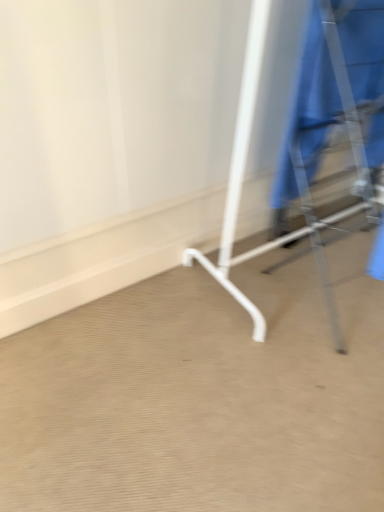
What is the approximate height of blue fabric robe at right?

blue fabric robe at right is 25.78 inches tall.

Describe the element at coordinates (309, 111) in the screenshot. I see `blue fabric robe at right` at that location.

Locate an element on the screen. Image resolution: width=384 pixels, height=512 pixels. blue fabric robe at right is located at coordinates (309, 111).

You are a GUI agent. You are given a task and a screenshot of the screen. Output one action in this format:
    pyautogui.click(x=<x>, y=<y>)
    Task: Click on the metallic silver coat rack at right
    This screenshot has height=512, width=384.
    Given the screenshot: What is the action you would take?
    click(x=312, y=130)

Describe the element at coordinates (312, 130) in the screenshot. The image size is (384, 512). I see `metallic silver coat rack at right` at that location.

Find the location of a particular element. This screenshot has width=384, height=512. blue fabric robe at right is located at coordinates (309, 111).

Between metallic silver coat rack at right and blue fabric robe at right, which one appears on the right side from the viewer's perspective?

metallic silver coat rack at right.

Looking at this image, does metallic silver coat rack at right come behind blue fabric robe at right?

No, metallic silver coat rack at right is in front of blue fabric robe at right.

Considering the positions of point (299, 182) and point (364, 25), is point (299, 182) closer or farther from the camera than point (364, 25)?

Clearly, point (299, 182) is more distant from the camera than point (364, 25).

In the scene shown: From the image's perspective, between metallic silver coat rack at right and blue fabric robe at right, who is located below?

metallic silver coat rack at right is shown below in the image.

From a real-world perspective, relative to blue fabric robe at right, is metallic silver coat rack at right vertically above or below?

In terms of real-world spatial position, metallic silver coat rack at right is below blue fabric robe at right.

Which object is thinner, metallic silver coat rack at right or blue fabric robe at right?

With smaller width is blue fabric robe at right.

Considering the relative sizes of metallic silver coat rack at right and blue fabric robe at right in the image provided, is metallic silver coat rack at right shorter than blue fabric robe at right?

No, metallic silver coat rack at right is not shorter than blue fabric robe at right.

Can you confirm if metallic silver coat rack at right is bigger than blue fabric robe at right?

Correct, metallic silver coat rack at right is larger in size than blue fabric robe at right.

Is blue fabric robe at right inside metallic silver coat rack at right?

That's correct, blue fabric robe at right is inside metallic silver coat rack at right.

Is metallic silver coat rack at right far away from blue fabric robe at right?

Actually, metallic silver coat rack at right and blue fabric robe at right are a little close together.

In the scene shown: Is metallic silver coat rack at right positioned with its back to blue fabric robe at right?

No, metallic silver coat rack at right is not facing away from blue fabric robe at right.

From the picture: Can you tell me how much metallic silver coat rack at right and blue fabric robe at right differ in facing direction?

90 degrees.

Measure the distance between metallic silver coat rack at right and blue fabric robe at right.

A distance of 3.53 inches exists between metallic silver coat rack at right and blue fabric robe at right.

Find the location of `furniture that appears in front of the blue fabric robe at right`. furniture that appears in front of the blue fabric robe at right is located at coordinates (312, 130).

Considering the positions of objects blue fabric robe at right and metallic silver coat rack at right in the image provided, who is more to the left, blue fabric robe at right or metallic silver coat rack at right?

blue fabric robe at right.

Is blue fabric robe at right behind metallic silver coat rack at right?

Yes, it is behind metallic silver coat rack at right.

Is point (291, 173) closer to viewer compared to point (328, 98)?

No, (291, 173) is further to viewer.

From the image's perspective, is blue fabric robe at right above or below metallic silver coat rack at right?

Based on their image positions, blue fabric robe at right is located above metallic silver coat rack at right.

From a real-world perspective, does blue fabric robe at right sit lower than metallic silver coat rack at right?

No, from a real-world perspective, blue fabric robe at right is not beneath metallic silver coat rack at right.

Does blue fabric robe at right have a greater width compared to metallic silver coat rack at right?

Incorrect, the width of blue fabric robe at right does not surpass that of metallic silver coat rack at right.

Between blue fabric robe at right and metallic silver coat rack at right, which one has less height?

With less height is blue fabric robe at right.

Based on their sizes in the image, would you say blue fabric robe at right is bigger or smaller than metallic silver coat rack at right?

blue fabric robe at right is smaller than metallic silver coat rack at right.

Is blue fabric robe at right not within metallic silver coat rack at right?

No.

Is blue fabric robe at right not close to metallic silver coat rack at right?

That's not correct — blue fabric robe at right is a little close to metallic silver coat rack at right.

Consider the image. Could you tell me if blue fabric robe at right is turned towards metallic silver coat rack at right?

Yes, blue fabric robe at right is facing metallic silver coat rack at right.

Can you tell me how much blue fabric robe at right and metallic silver coat rack at right differ in facing direction?

They differ by 90 degrees in their facing directions.

This screenshot has width=384, height=512. Find the location of `furniture in front of the blue fabric robe at right`. furniture in front of the blue fabric robe at right is located at coordinates pos(312,130).

Find the location of `robe that is above the metallic silver coat rack at right (from a real-world perspective)`. robe that is above the metallic silver coat rack at right (from a real-world perspective) is located at coordinates (309, 111).

Locate an element on the screen. robe located behind the metallic silver coat rack at right is located at coordinates (309, 111).